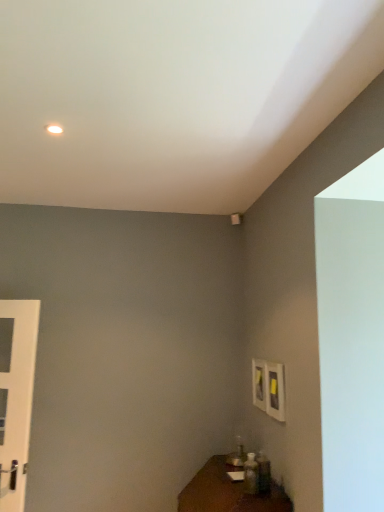
Question: Is brown wooden table at lower right at the back of white glossy door at left?

Choices:
 (A) no
 (B) yes

Answer: (A)

Question: Is white glossy door at left smaller than brown wooden table at lower right?

Choices:
 (A) yes
 (B) no

Answer: (A)

Question: Does white glossy door at left come behind brown wooden table at lower right?

Choices:
 (A) yes
 (B) no

Answer: (A)

Question: Is white glossy door at left wider than brown wooden table at lower right?

Choices:
 (A) yes
 (B) no

Answer: (B)

Question: Is white glossy door at left far away from brown wooden table at lower right?

Choices:
 (A) yes
 (B) no

Answer: (A)

Question: Can you confirm if white glossy door at left is taller than brown wooden table at lower right?

Choices:
 (A) yes
 (B) no

Answer: (A)

Question: Does brown wooden table at lower right lie in front of white glossy door at left?

Choices:
 (A) no
 (B) yes

Answer: (B)

Question: Does brown wooden table at lower right have a lesser height compared to white glossy door at left?

Choices:
 (A) no
 (B) yes

Answer: (B)

Question: Is brown wooden table at lower right at the left side of white glossy door at left?

Choices:
 (A) no
 (B) yes

Answer: (A)

Question: Is brown wooden table at lower right oriented towards white glossy door at left?

Choices:
 (A) no
 (B) yes

Answer: (A)

Question: Is brown wooden table at lower right bigger than white glossy door at left?

Choices:
 (A) yes
 (B) no

Answer: (A)

Question: Is white glossy door at left at the back of brown wooden table at lower right?

Choices:
 (A) no
 (B) yes

Answer: (A)

Question: From the image's perspective, is white glossy door at left positioned above or below brown wooden table at lower right?

Choices:
 (A) above
 (B) below

Answer: (A)